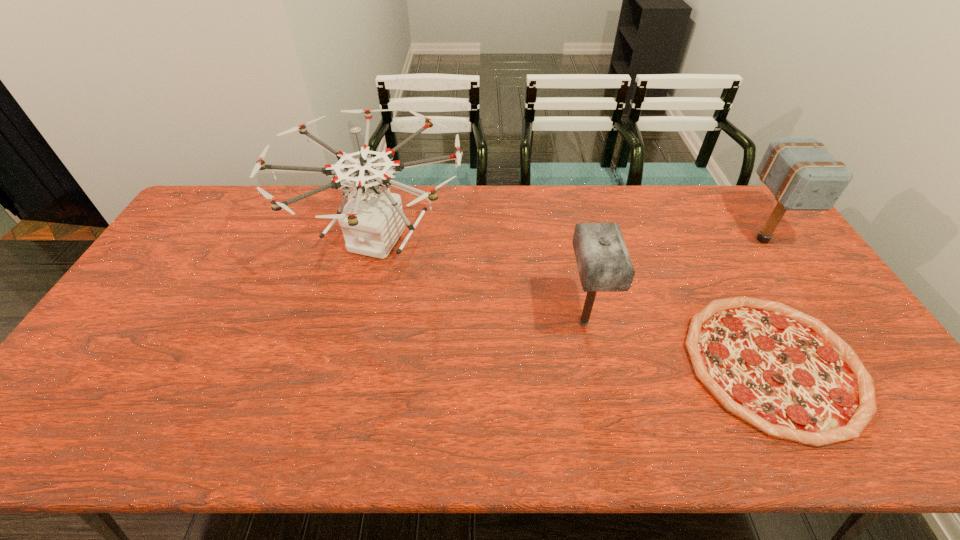
In the image, there is a desktop. Where is `vacant space at the near right corner`? This screenshot has width=960, height=540. vacant space at the near right corner is located at coordinates (919, 420).

Where is `free area in between the pizza and the drone`? free area in between the pizza and the drone is located at coordinates (576, 302).

Identify the location of blank region between the leftmost object and the left mallet. (481, 280).

This screenshot has width=960, height=540. Identify the location of vacant area between the right mallet and the leftmost object. (570, 239).

This screenshot has width=960, height=540. Identify the location of empty space between the leftmost object and the left mallet. (481, 280).

Identify the location of vacant area between the farther mallet and the leftmost object. point(570,239).

Where is `free area in between the drone and the pizza`? The height and width of the screenshot is (540, 960). free area in between the drone and the pizza is located at coordinates (576, 302).

The image size is (960, 540). I want to click on the third closest object relative to the farther mallet, so click(x=371, y=221).

The image size is (960, 540). In order to click on object that is the third closest to the pizza in this screenshot , I will do `click(371, 221)`.

You are a GUI agent. You are given a task and a screenshot of the screen. Output one action in this format:
    pyautogui.click(x=<x>, y=<y>)
    Task: Click on the vacant space that satisfies the following two spatial constraints: 1. on the front side of the pizza; 2. on the right side of the drone
    The width and height of the screenshot is (960, 540).
    Given the screenshot: What is the action you would take?
    [348, 364]